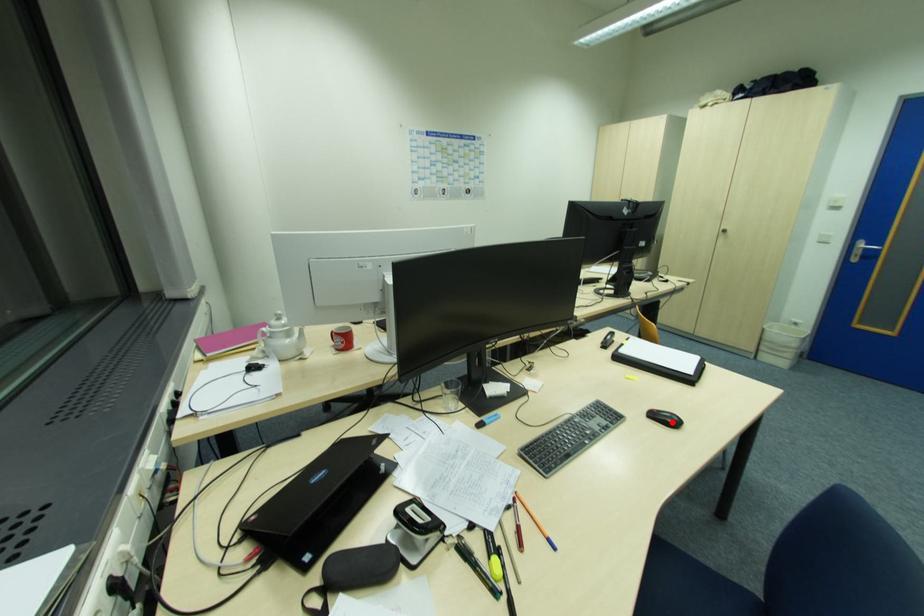
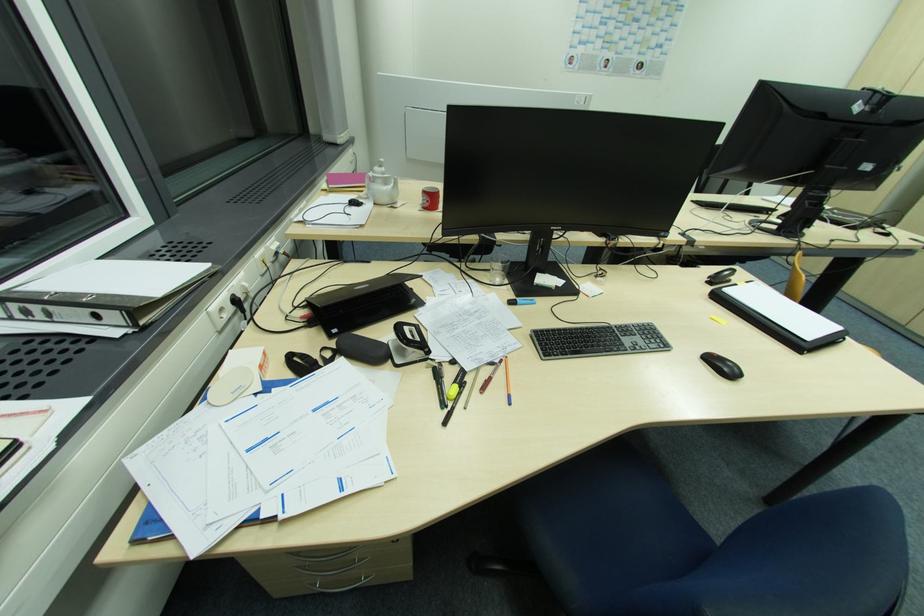
The point at the highlighted location is marked in the first image. Where is the corresponding point in the second image?

(728, 371)